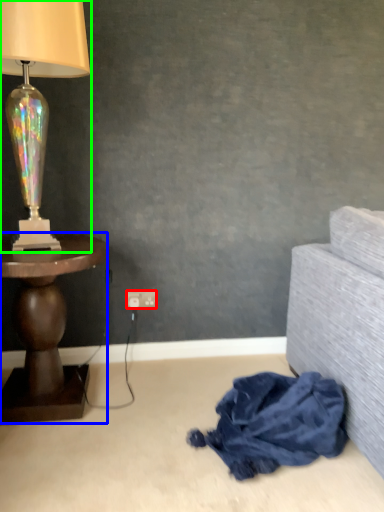
Question: Estimate the real-world distances between objects in this image. Which object is closer to power outlet (highlighted by a red box), table (highlighted by a blue box) or lamp (highlighted by a green box)?

Choices:
 (A) table
 (B) lamp

Answer: (A)